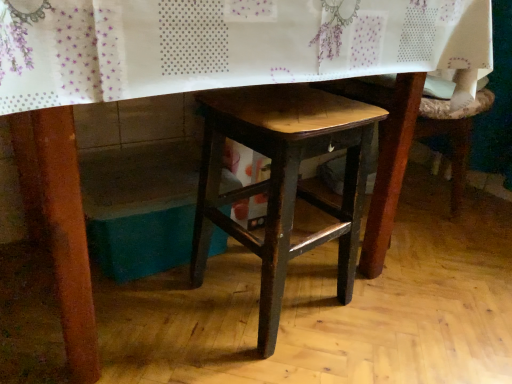
Locate an element on the screen. This screenshot has height=384, width=512. free spot to the right of wooden stool at center is located at coordinates (386, 315).